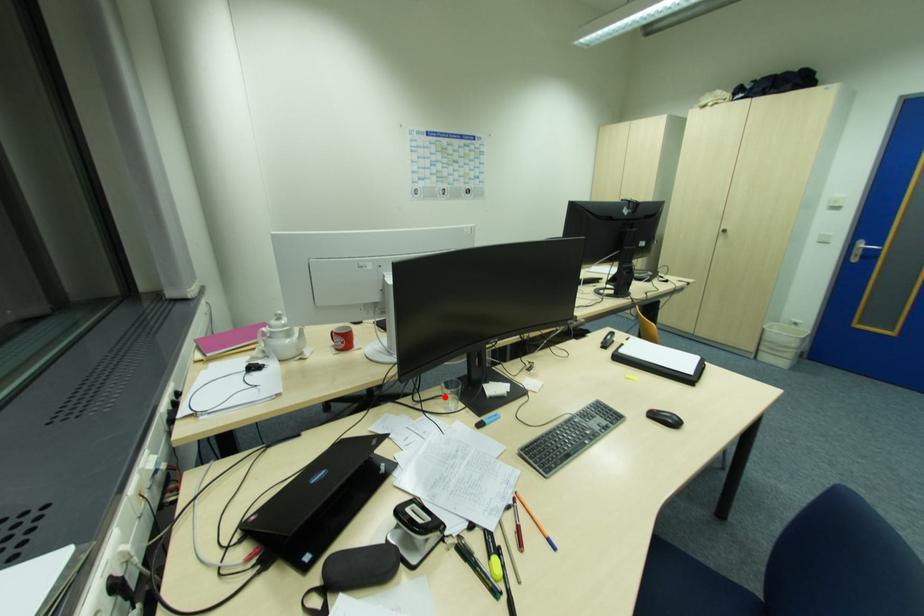
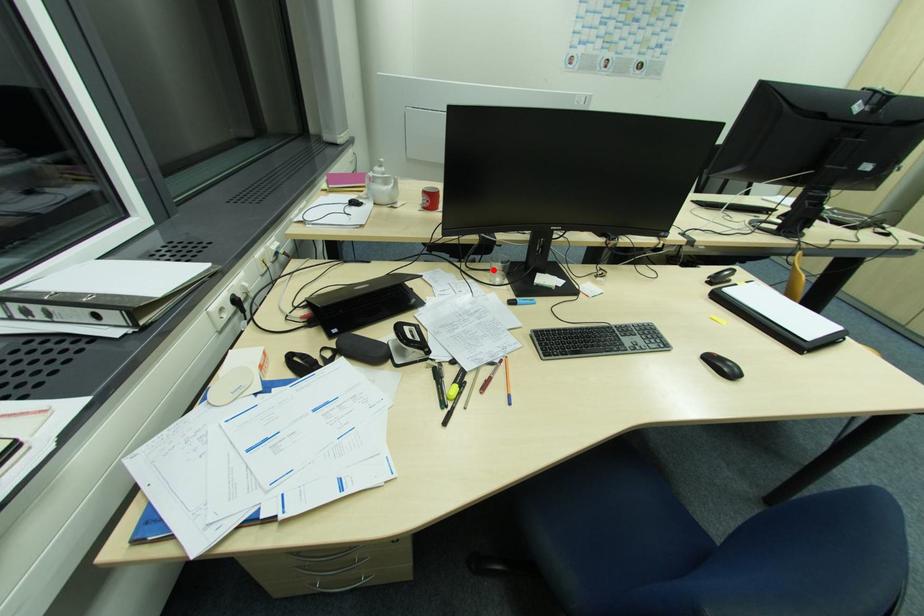
I am providing you with two images of the same scene from different viewpoints. A red point is marked on the first image and another point is marked on the second image. Is the red point in image1 aligned with the point shown in image2?

Yes